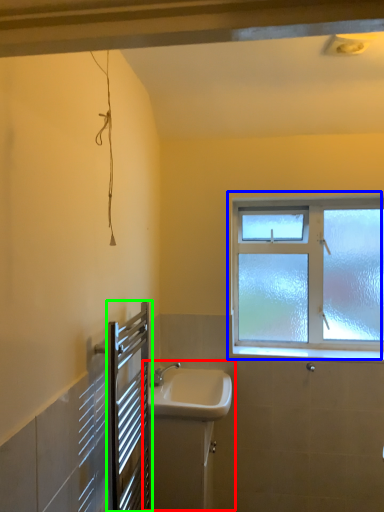
Question: Based on their relative distances, which object is nearer to sink (highlighted by a red box)? Choose from window (highlighted by a blue box) and screen door (highlighted by a green box).

Choices:
 (A) window
 (B) screen door

Answer: (B)